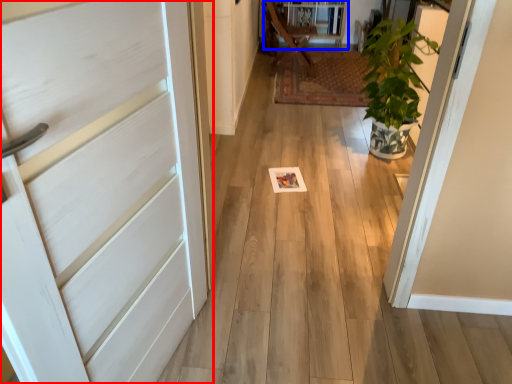
Question: Which point is closer to the camera, door (highlighted by a red box) or bookshelf (highlighted by a blue box)?

Choices:
 (A) door
 (B) bookshelf

Answer: (A)